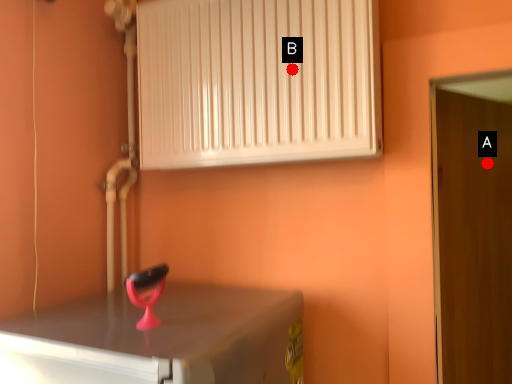
Question: Two points are circled on the image, labeled by A and B beside each circle. Which point is closer to the camera?

Choices:
 (A) A is closer
 (B) B is closer

Answer: (B)